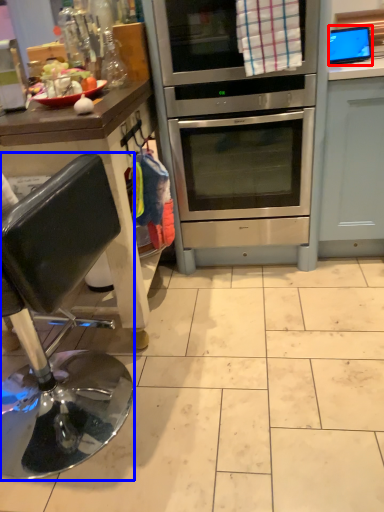
Question: Which object appears farthest to the camera in this image, appliance (highlighted by a red box) or chair (highlighted by a blue box)?

Choices:
 (A) appliance
 (B) chair

Answer: (A)